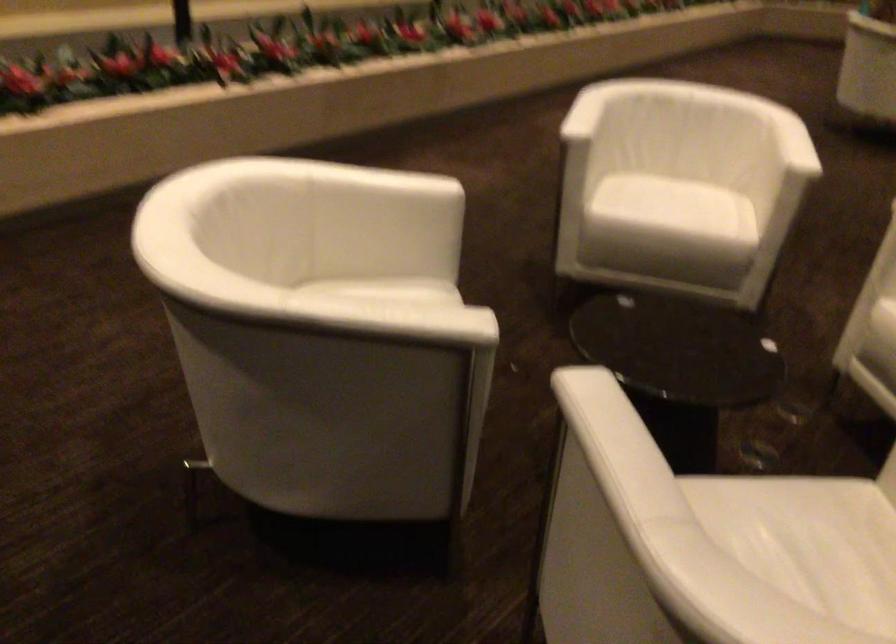
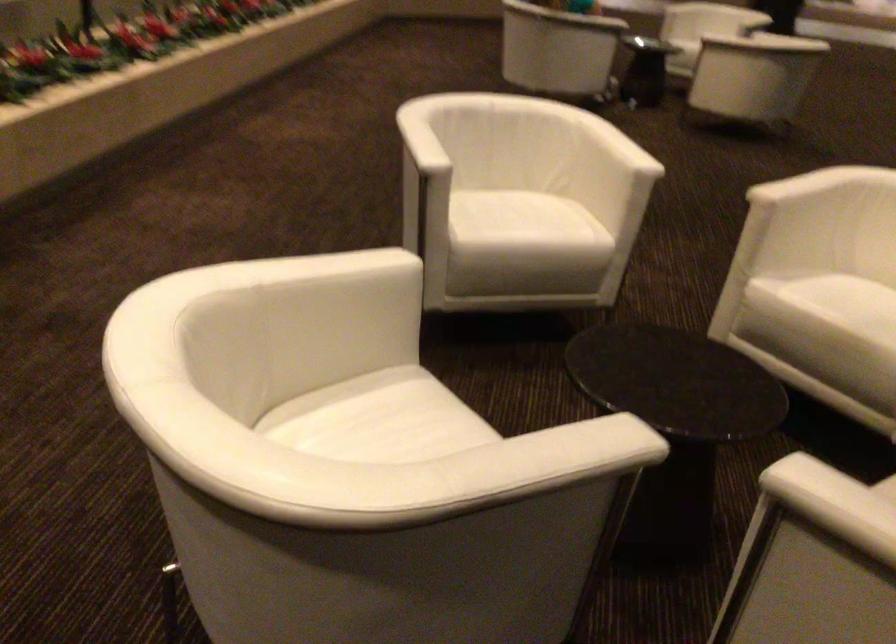
Question: The first image is from the beginning of the video and the second image is from the end. How did the camera likely rotate when shooting the video?

Choices:
 (A) Left
 (B) Right
 (C) Up
 (D) Down

Answer: (B)